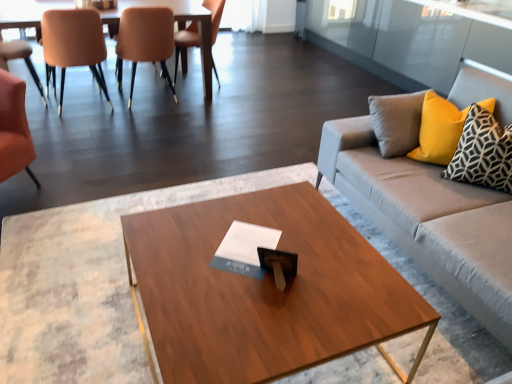
You are a GUI agent. You are given a task and a screenshot of the screen. Output one action in this format:
    pyautogui.click(x=<x>, y=<y>)
    Task: Click on the free space in front of matte orange chair at left, the fourth chair in the left-to-right sequence
    This screenshot has width=512, height=384.
    Given the screenshot: What is the action you would take?
    pyautogui.click(x=138, y=115)